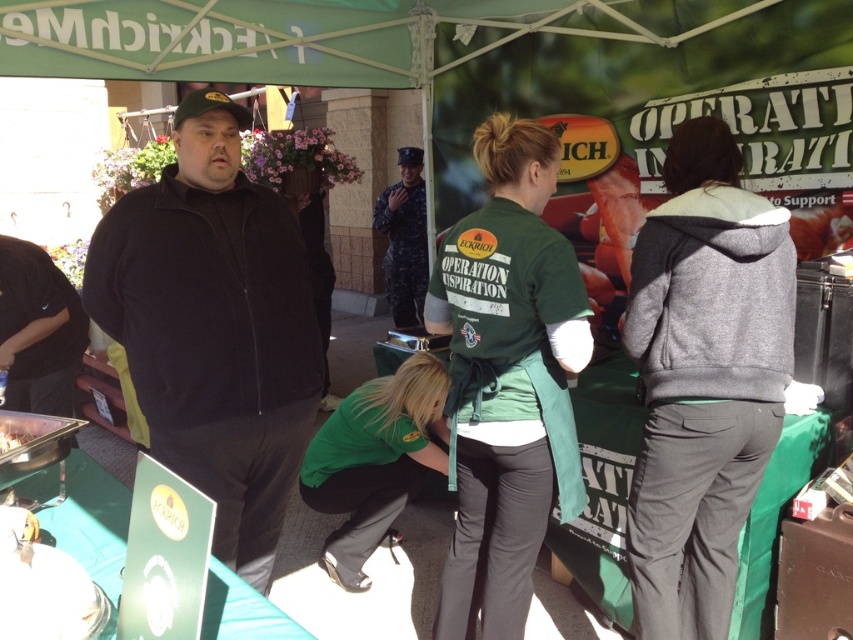
Which is above, black fleece jacket at center or green fabric shirt at center?

black fleece jacket at center

From the picture: Is black fleece jacket at center behind green fabric shirt at center?

Yes, it is.

Is point (164, 454) in front of point (503, 324)?

No, (164, 454) is further to viewer.

Image resolution: width=853 pixels, height=640 pixels. In order to click on black fleece jacket at center in this screenshot , I will do `click(213, 326)`.

Can you confirm if black fleece jacket at center is positioned above gray fleece hoodie at right?

Yes.

The width and height of the screenshot is (853, 640). I want to click on black fleece jacket at center, so click(x=213, y=326).

The height and width of the screenshot is (640, 853). In order to click on black fleece jacket at center in this screenshot , I will do `click(213, 326)`.

Is point (148, 268) more distant than point (408, 204)?

No, it is not.

Measure the distance from black fleece jacket at center to camouflage fabric uniform at center.

3.34 meters

Identify the location of black fleece jacket at center. This screenshot has width=853, height=640. (213, 326).

The width and height of the screenshot is (853, 640). What are the coordinates of `black fleece jacket at center` in the screenshot? It's located at (213, 326).